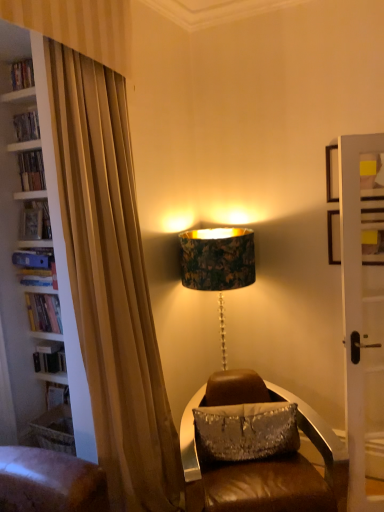
Question: From a real-world perspective, is brown leather chair at center beneath blue hardcover book at left, which is the 2th book from bottom to top?

Choices:
 (A) no
 (B) yes

Answer: (B)

Question: Are brown leather chair at center and blue hardcover book at left, the 3th book positioned from the top, making contact?

Choices:
 (A) yes
 (B) no

Answer: (B)

Question: Considering the relative sizes of brown leather chair at center and blue hardcover book at left, the 3th book positioned from the top, in the image provided, is brown leather chair at center thinner than blue hardcover book at left, the 3th book positioned from the top,?

Choices:
 (A) no
 (B) yes

Answer: (A)

Question: Considering the relative sizes of brown leather chair at center and blue hardcover book at left, which is the 2th book from bottom to top, in the image provided, is brown leather chair at center bigger than blue hardcover book at left, which is the 2th book from bottom to top,?

Choices:
 (A) no
 (B) yes

Answer: (B)

Question: From a real-world perspective, does brown leather chair at center stand above blue hardcover book at left, which is the 2th book from bottom to top?

Choices:
 (A) yes
 (B) no

Answer: (B)

Question: From the image's perspective, relative to brown leather chair at center, is silver sequined pillow at center above or below?

Choices:
 (A) below
 (B) above

Answer: (B)

Question: Which is correct: silver sequined pillow at center is inside brown leather chair at center, or outside of it?

Choices:
 (A) inside
 (B) outside

Answer: (A)

Question: Would you say silver sequined pillow at center is to the left or to the right of brown leather chair at center in the picture?

Choices:
 (A) left
 (B) right

Answer: (A)

Question: In terms of height, does silver sequined pillow at center look taller or shorter compared to brown leather chair at center?

Choices:
 (A) short
 (B) tall

Answer: (A)

Question: Considering the positions of point (41, 229) and point (29, 271), is point (41, 229) closer or farther from the camera than point (29, 271)?

Choices:
 (A) closer
 (B) farther

Answer: (A)

Question: Considering their positions, is hardcover book at left, acting as the third book starting from the bottom, located in front of or behind blue hardcover book at left, the 3th book positioned from the top?

Choices:
 (A) behind
 (B) front

Answer: (A)

Question: From a real-world perspective, is hardcover book at left, acting as the third book starting from the bottom, positioned above or below blue hardcover book at left, which is the 2th book from bottom to top?

Choices:
 (A) below
 (B) above

Answer: (B)

Question: Would you say hardcover book at left, acting as the third book starting from the bottom, is to the left or to the right of blue hardcover book at left, the 3th book positioned from the top, in the picture?

Choices:
 (A) right
 (B) left

Answer: (B)

Question: Is hardcover book at left, the first book ordered from the bottom, bigger or smaller than brown leather chair at center?

Choices:
 (A) small
 (B) big

Answer: (A)

Question: From a real-world perspective, is hardcover book at left, which is the 4th book in top-to-bottom order, physically located above or below brown leather chair at center?

Choices:
 (A) above
 (B) below

Answer: (A)